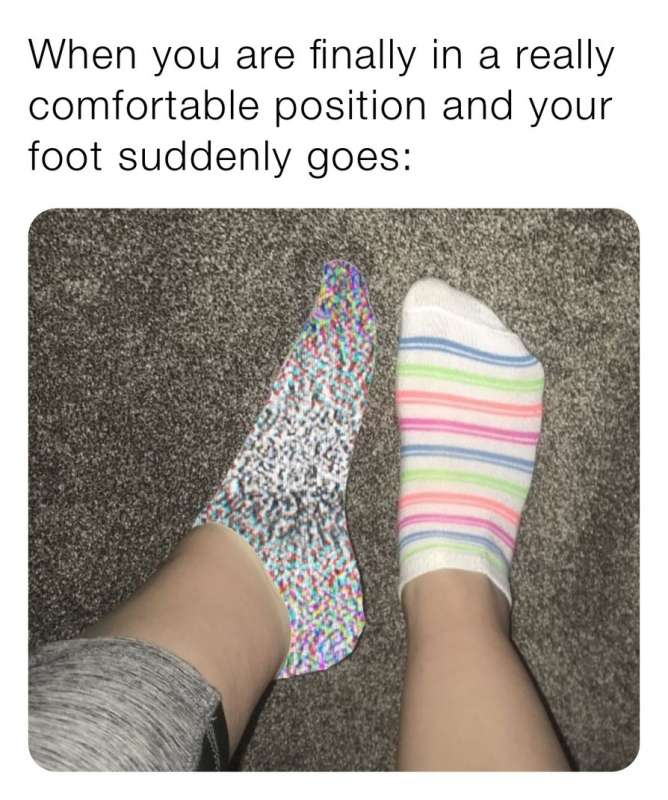
Where is `carpet`? Image resolution: width=668 pixels, height=800 pixels. carpet is located at coordinates (53, 222).